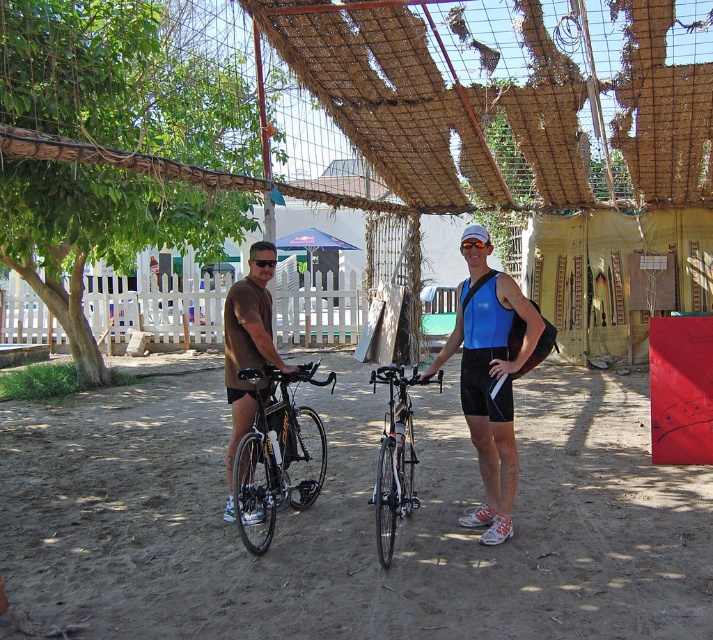
You are a photographer trying to capture a photo of the matte black bicycle at center and the brown matte shorts at center. Which object should you focus on first if you want to ensure both are in focus without adjusting the camera settings?

The matte black bicycle at center is located below brown matte shorts at center. Since the bicycle is lower, focusing on the brown matte shorts at center first will ensure both are in focus as they are aligned vertically.

You are planning to transport both the matte black bicycle at center and the brown matte shorts at center in a vehicle with limited space. Based on their sizes, which item should you load first to ensure both fit properly?

The matte black bicycle at center is larger than the brown matte shorts at center, so you should load the matte black bicycle at center first to accommodate its size before placing the smaller brown matte shorts at center.

You are planning to place a small table between the matte black bicycle at center and the brown matte shorts at center. The table requires 6 feet of space. Based on the scene description, will there be enough space for the table?

The matte black bicycle at center is 5.88 feet away from the brown matte shorts at center, so the table requiring 6 feet of space will not fit between them.